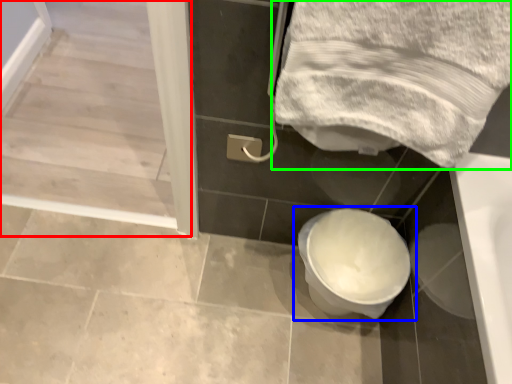
Question: Considering the real-world distances, which object is farthest from screen door (highlighted by a red box)? toilet (highlighted by a blue box) or towel (highlighted by a green box)?

Choices:
 (A) toilet
 (B) towel

Answer: (A)